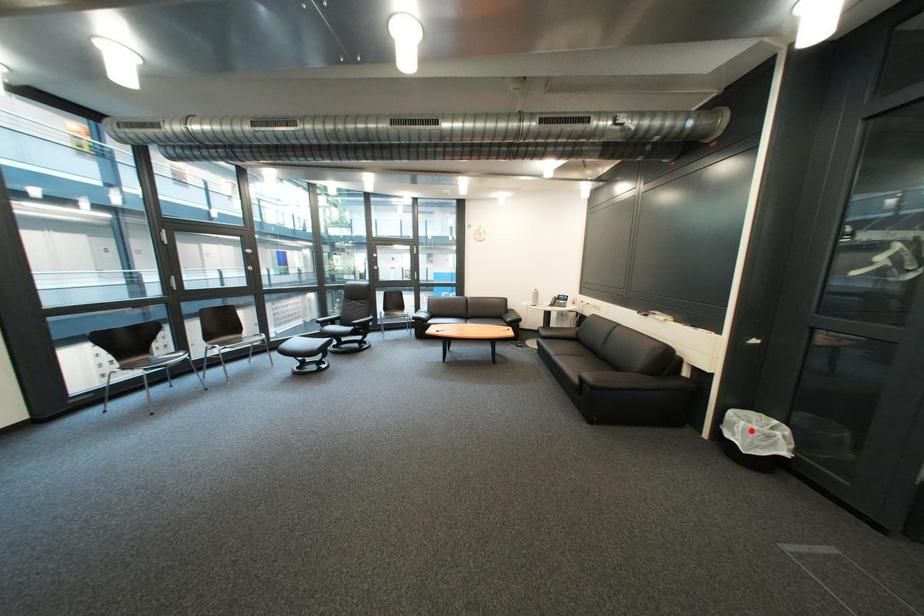
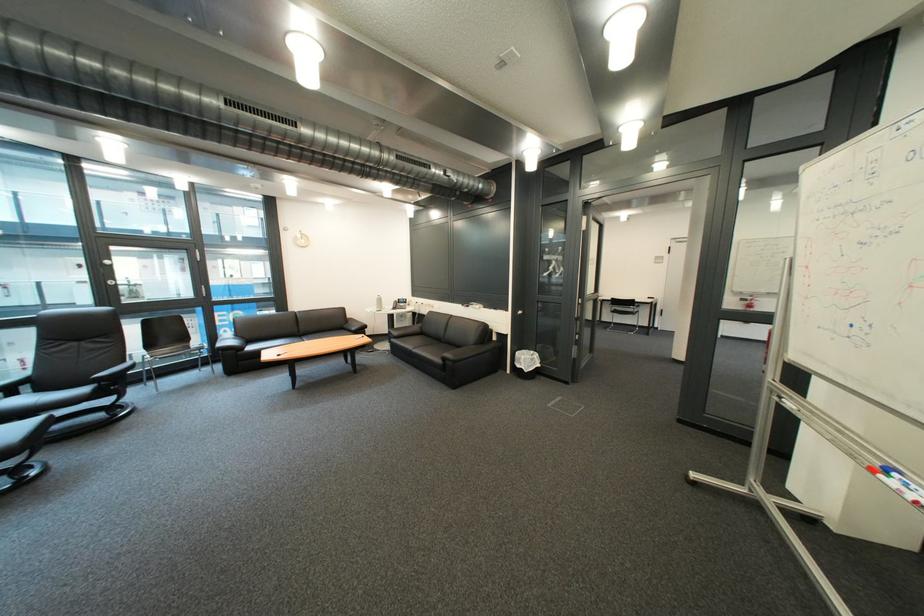
Question: I am providing you with two images of the same scene from different viewpoints. A red point is shown in image1. For the corresponding object point in image2, is it positioned nearer or farther from the camera?

Choices:
 (A) Nearer
 (B) Farther

Answer: (B)